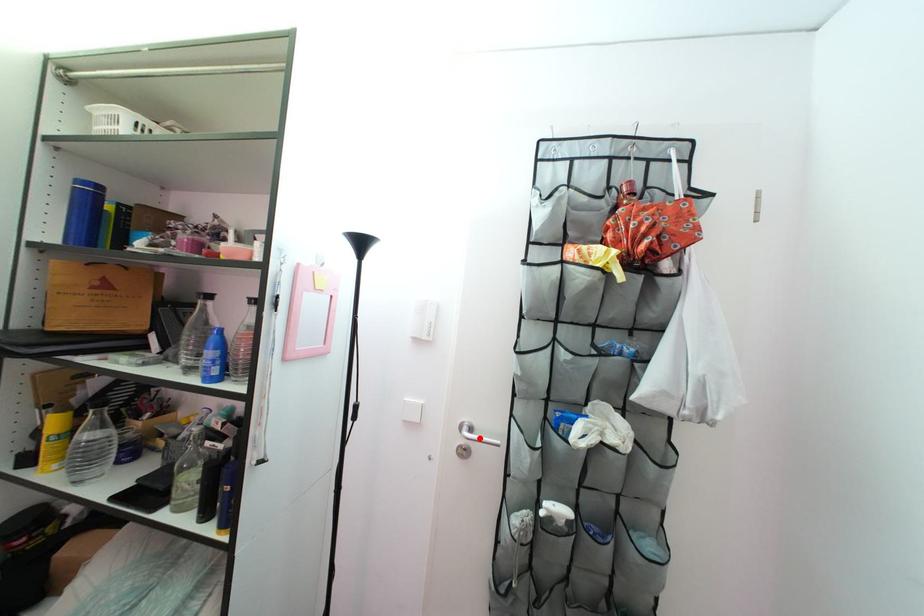
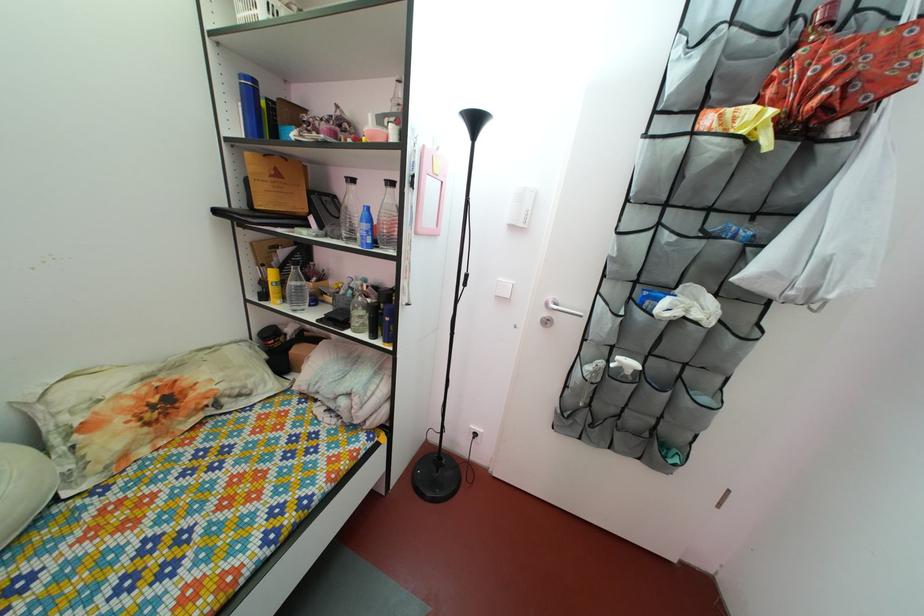
In the second image, find the point that corresponds to the highlighted location in the first image.

(565, 313)